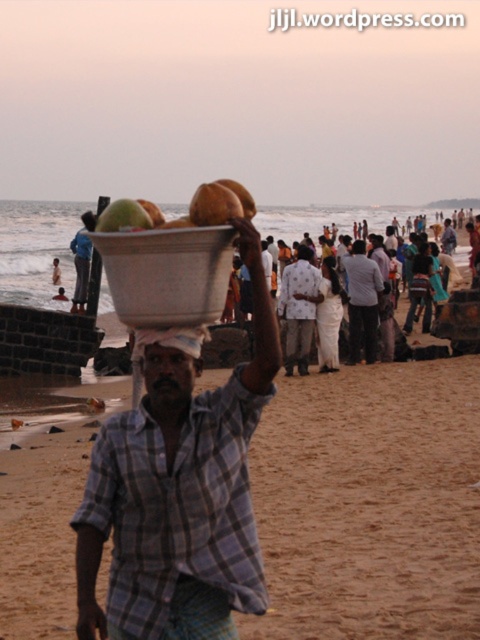
You are a beachgoer who wants to place a green matte coconut at center into a white matte bowl at center. Based on their positions, which direction should you move the coconut to reach the bowl?

The white matte bowl at center is to the right of the green matte coconut at center, so you should move the coconut to the right to reach the bowl.

You are a beach vendor who needs to display a white matte bowl at center and a green matte coconut at center on a small shelf. The shelf can only hold items that are narrower than 10 inches. Can both items fit on the shelf?

The white matte bowl at center is narrower than the green matte coconut at center, but since the shelf requires items narrower than 10 inches, we need to know the exact width of the coconut to confirm. However, the description only states their relative sizes, not absolute measurements. Therefore, it is uncertain if both will fit without additional information.

You are a photographer trying to capture the man with the bucket on his head. You notice the white cotton clothing at center and the matte white head at center in your frame. Which object should you focus on to ensure the subject of the photo is clear?

You should focus on the matte white head at center because it is smaller and more distinct compared to the white cotton clothing at center, making it easier to highlight the subject.